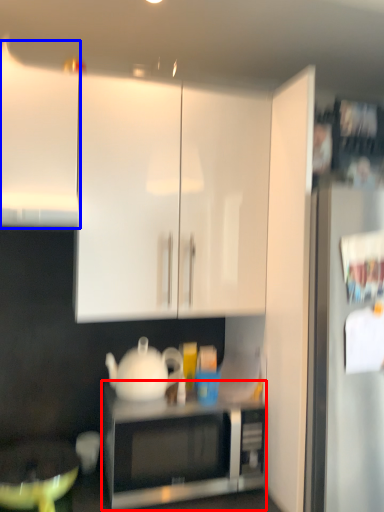
Question: Which object is closer to the camera taking this photo, microwave oven (highlighted by a red box) or cabinetry (highlighted by a blue box)?

Choices:
 (A) microwave oven
 (B) cabinetry

Answer: (B)